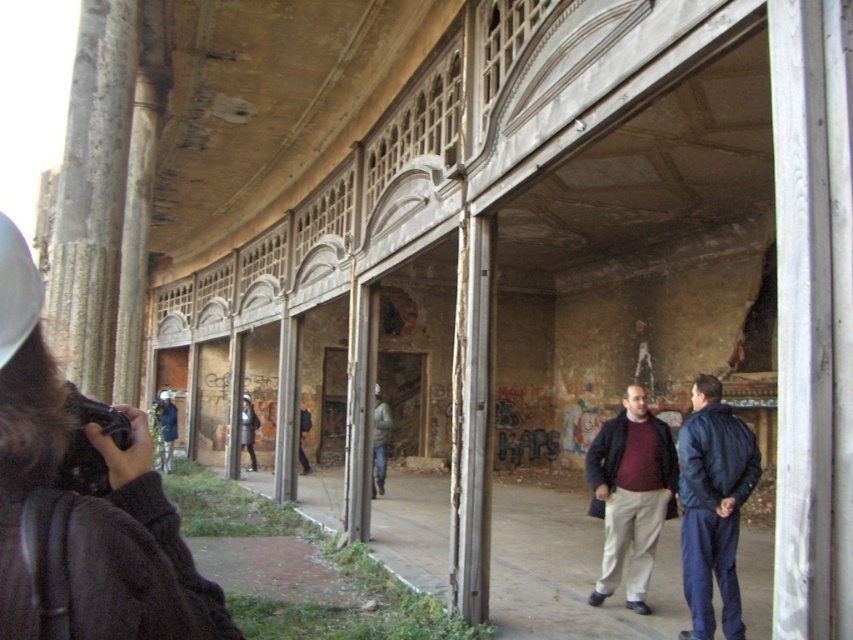
Is brown knitted sweater at lower left smaller than matte maroon sweater at center?

Yes.

Is point (144, 461) farther from viewer compared to point (637, 490)?

No, it is in front of (637, 490).

Where is `brown knitted sweater at lower left`? brown knitted sweater at lower left is located at coordinates (80, 504).

Does brown knitted sweater at lower left appear on the right side of dark gray jacket at center?

Indeed, brown knitted sweater at lower left is positioned on the right side of dark gray jacket at center.

Does brown knitted sweater at lower left appear over dark gray jacket at center?

Yes, brown knitted sweater at lower left is above dark gray jacket at center.

Where is `brown knitted sweater at lower left`? The image size is (853, 640). brown knitted sweater at lower left is located at coordinates (80, 504).

Locate an element on the screen. Image resolution: width=853 pixels, height=640 pixels. brown knitted sweater at lower left is located at coordinates (80, 504).

Is matte maroon sweater at center below dark gray jacket at center?

Actually, matte maroon sweater at center is above dark gray jacket at center.

Between matte maroon sweater at center and dark gray jacket at center, which one has more height?

matte maroon sweater at center

Locate an element on the screen. The height and width of the screenshot is (640, 853). matte maroon sweater at center is located at coordinates (630, 493).